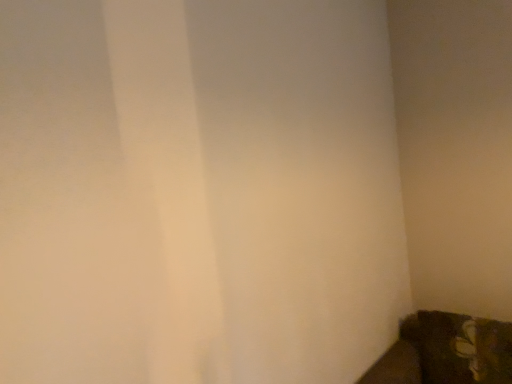
What do you see at coordinates (446, 352) in the screenshot? The width and height of the screenshot is (512, 384). I see `brown fuzzy couch at lower right` at bounding box center [446, 352].

Identify the location of brown fuzzy couch at lower right. This screenshot has width=512, height=384. (446, 352).

At what (x,y) coordinates should I click in order to perform the action: click on brown fuzzy couch at lower right. Please return your answer as a coordinate pair (x, y). This screenshot has height=384, width=512. Looking at the image, I should click on (446, 352).